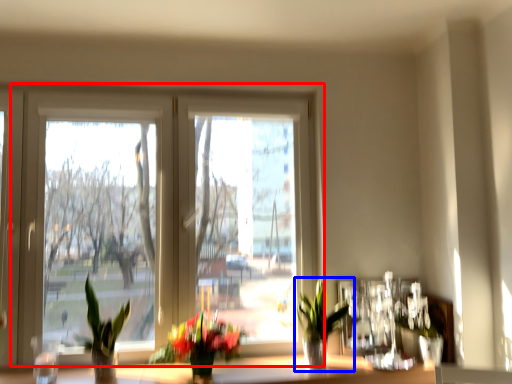
Question: Which of the following is the closest to the observer, window (highlighted by a red box) or houseplant (highlighted by a blue box)?

Choices:
 (A) window
 (B) houseplant

Answer: (B)